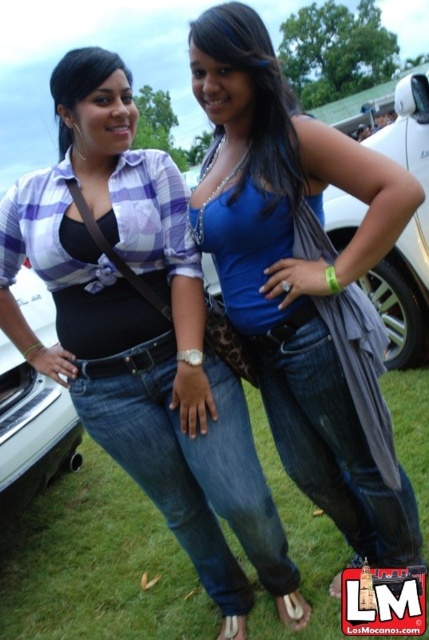
Measure the distance from matte black tank top at center to blue matte tank top at center.

matte black tank top at center is 13.95 inches from blue matte tank top at center.

Where is `matte black tank top at center`? This screenshot has height=640, width=429. matte black tank top at center is located at coordinates (142, 336).

Does blue matte tank top at center have a greater width compared to black leather car at left?

Indeed, blue matte tank top at center has a greater width compared to black leather car at left.

Does blue matte tank top at center appear under black leather car at left?

Incorrect, blue matte tank top at center is not positioned below black leather car at left.

Locate an element on the screen. This screenshot has width=429, height=640. blue matte tank top at center is located at coordinates (296, 269).

Where is `blue matte tank top at center`? blue matte tank top at center is located at coordinates (296, 269).

How far apart are black leather car at left and matte black top at center?

black leather car at left is 5.19 feet away from matte black top at center.

Is point (63, 451) in front of point (90, 81)?

No, it is not.

Is point (21, 404) positioned before point (78, 92)?

No, (21, 404) is further to viewer.

Find the location of a particular element. This screenshot has width=429, height=640. black leather car at left is located at coordinates (32, 432).